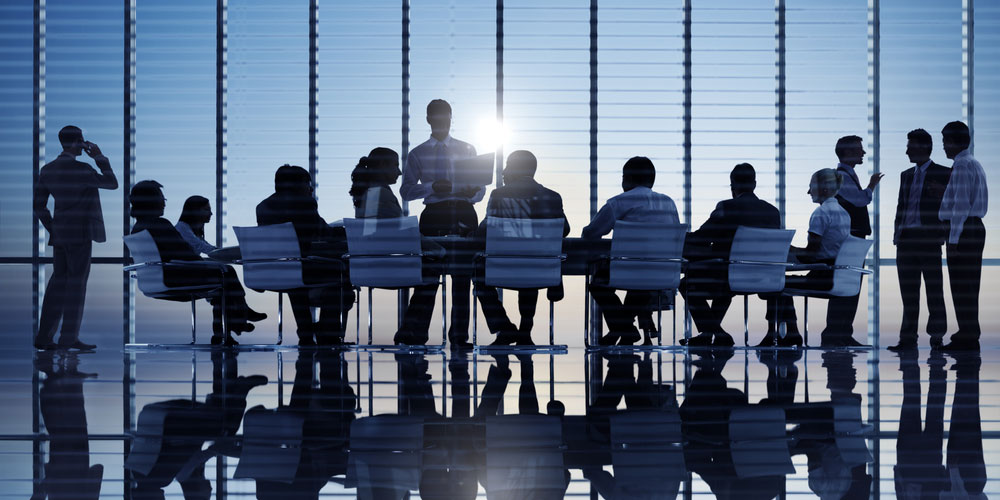
Image resolution: width=1000 pixels, height=500 pixels. I want to click on chairs, so click(x=160, y=283), click(x=263, y=269), click(x=395, y=261), click(x=517, y=259), click(x=650, y=268), click(x=777, y=275), click(x=839, y=280).